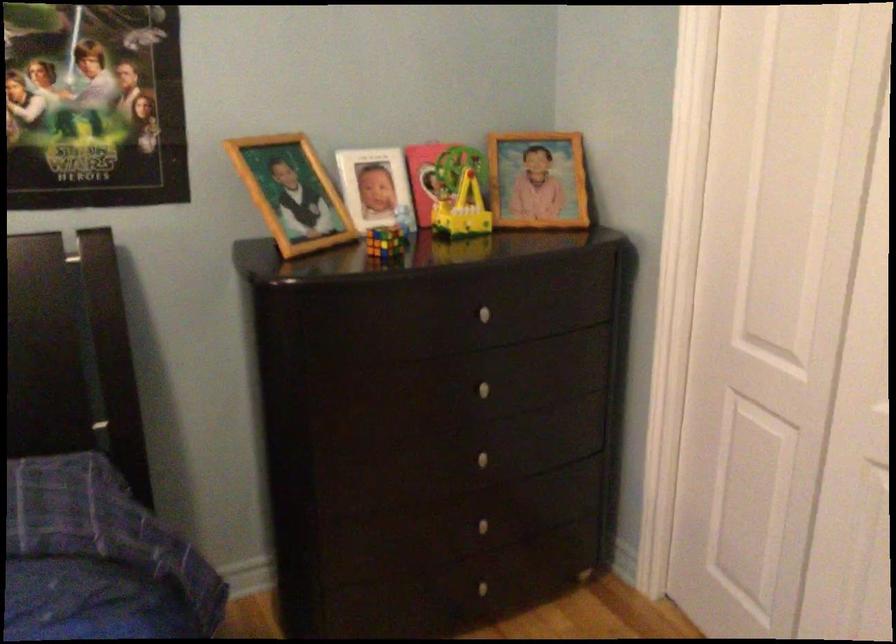
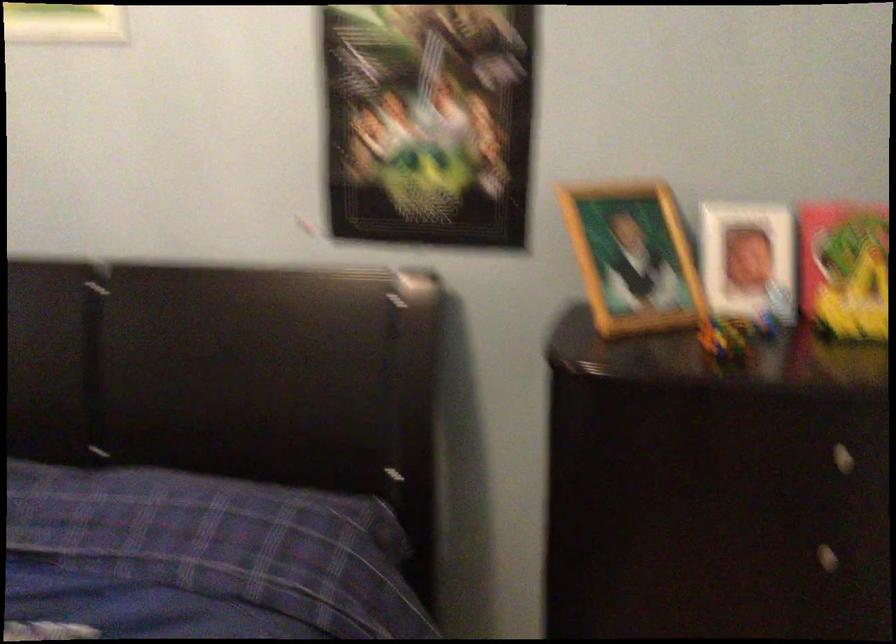
Locate, in the second image, the point that corresponds to (x=381, y=189) in the first image.

(748, 261)